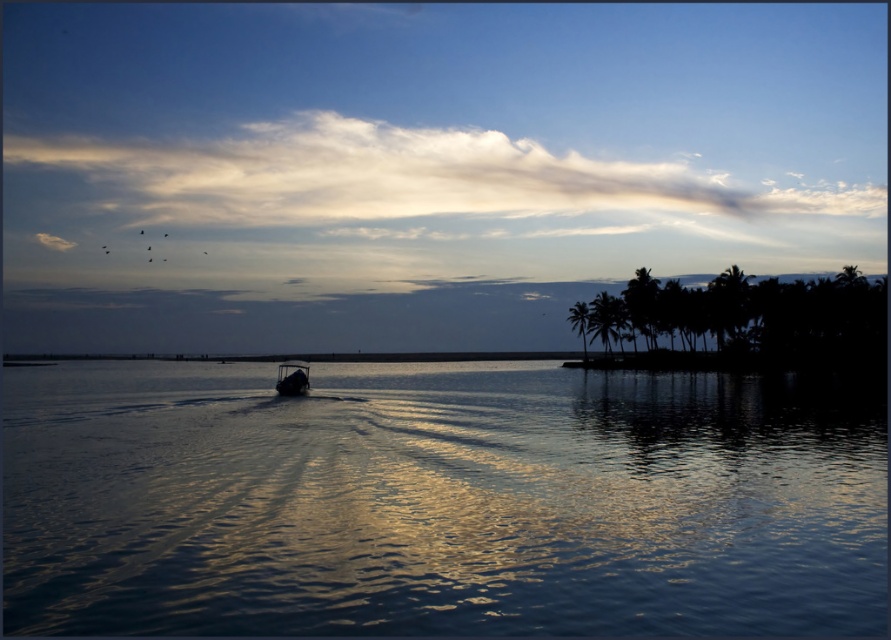
Question: Among these points, which one is farthest from the camera?

Choices:
 (A) (283, 390)
 (B) (601, 616)

Answer: (A)

Question: Can you confirm if glistening blue water at center is wider than metallic silver boat at center?

Choices:
 (A) yes
 (B) no

Answer: (A)

Question: Does glistening blue water at center appear over metallic silver boat at center?

Choices:
 (A) yes
 (B) no

Answer: (B)

Question: Among these points, which one is farthest from the camera?

Choices:
 (A) (297, 369)
 (B) (454, 502)

Answer: (A)

Question: Does glistening blue water at center have a larger size compared to metallic silver boat at center?

Choices:
 (A) yes
 (B) no

Answer: (A)